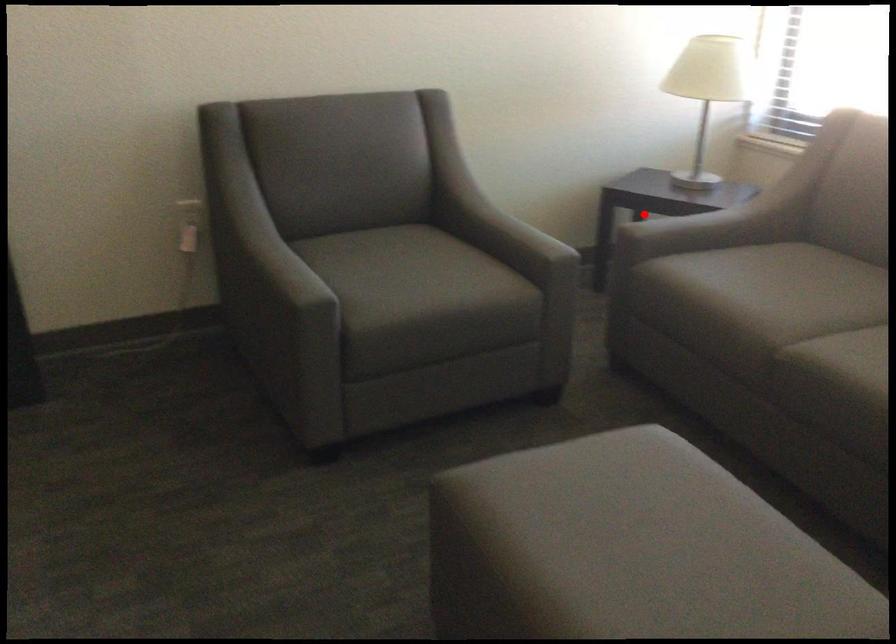
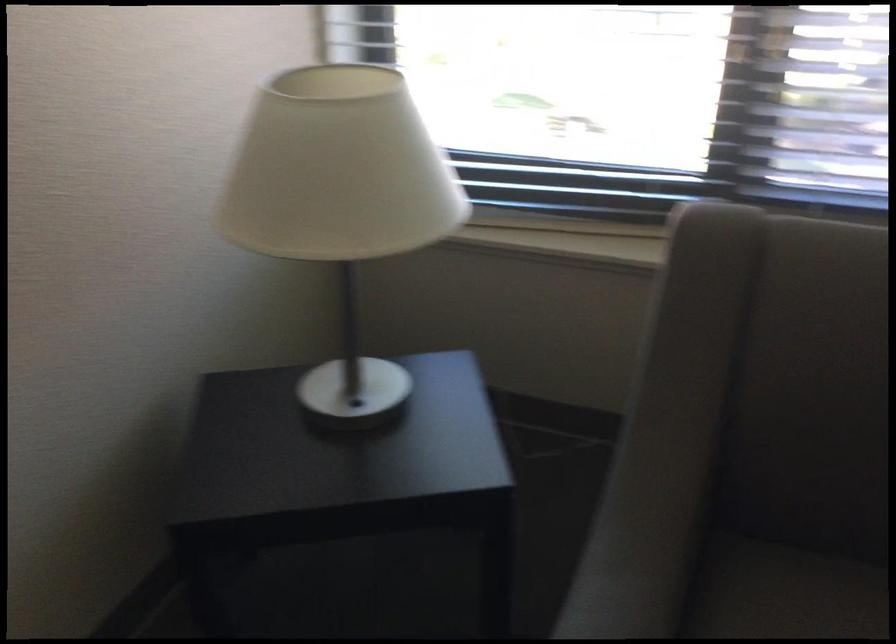
Question: I am providing you with two images of the same scene from different viewpoints. A red point is marked on the first image. At the location where the point appears in image 1, is it still visible in image 2?

Choices:
 (A) Yes
 (B) No

Answer: (B)